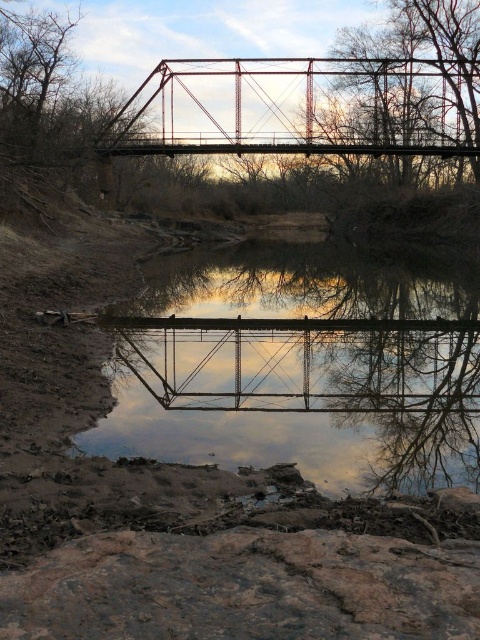
Question: Is reflective glass water at center in front of metallic red bridge at center?

Choices:
 (A) no
 (B) yes

Answer: (B)

Question: Among these points, which one is nearest to the camera?

Choices:
 (A) (210, 355)
 (B) (327, 93)

Answer: (A)

Question: Observing the image, what is the correct spatial positioning of reflective glass water at center in reference to metallic red bridge at center?

Choices:
 (A) left
 (B) right

Answer: (A)

Question: Which of the following is the farthest from the observer?

Choices:
 (A) (210, 134)
 (B) (402, 316)

Answer: (A)

Question: In this image, where is reflective glass water at center located relative to metallic red bridge at center?

Choices:
 (A) right
 (B) left

Answer: (B)

Question: Which point is closer to the camera taking this photo?

Choices:
 (A) (322, 152)
 (B) (225, 374)

Answer: (B)